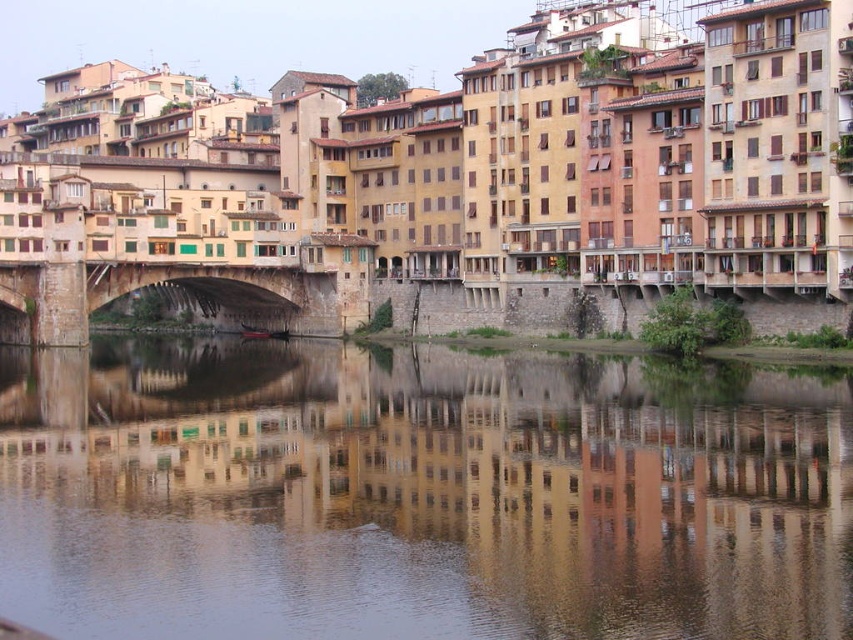
Is smooth water at center below stone arch bridge at center?

Yes.

Identify the location of smooth water at center. This screenshot has width=853, height=640. (419, 493).

Identify the location of smooth water at center. This screenshot has width=853, height=640. (419, 493).